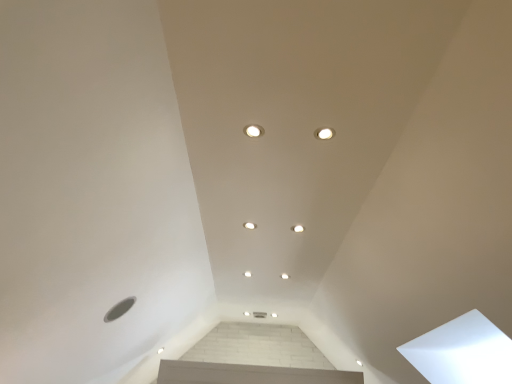
Question: Is the position of white glossy dot at center, which appears as the first dot when viewed from the left, less distant than that of white glossy light fixture at center, the fifth dot in the front-to-back sequence?

Choices:
 (A) yes
 (B) no

Answer: (A)

Question: From the image's perspective, would you say white glossy dot at center, the sixth dot viewed from the right, is shown under white glossy light fixture at center, which is the second dot in bottom-to-top order?

Choices:
 (A) no
 (B) yes

Answer: (A)

Question: Is white glossy dot at center, marked as the third dot in a bottom-to-top arrangement, outside of white glossy light fixture at center, the fifth dot in the front-to-back sequence?

Choices:
 (A) yes
 (B) no

Answer: (A)

Question: Are white glossy dot at center, which ranks as the 4th dot in front-to-back order, and white glossy light fixture at center, which is the fifth dot from top to bottom, far apart?

Choices:
 (A) yes
 (B) no

Answer: (B)

Question: Is white glossy light fixture at center, which appears as the second dot when viewed from the back, surrounded by white glossy dot at center, the sixth dot viewed from the right?

Choices:
 (A) yes
 (B) no

Answer: (B)

Question: In the image, is white glossy light fixture at center, acting as the 4th dot starting from the bottom, on the left side or the right side of white glossy light fixture at center, which appears as the second dot when viewed from the back?

Choices:
 (A) right
 (B) left

Answer: (A)

Question: Considering their positions, is white glossy light fixture at center, placed as the 5th dot when sorted from back to front, located in front of or behind white glossy light fixture at center, which appears as the second dot when viewed from the back?

Choices:
 (A) front
 (B) behind

Answer: (A)

Question: Is white glossy light fixture at center, placed as the 5th dot when sorted from back to front, inside the boundaries of white glossy light fixture at center, which is the second dot in bottom-to-top order, or outside?

Choices:
 (A) outside
 (B) inside

Answer: (A)

Question: From the image's perspective, is white glossy light fixture at center, which appears as the second dot when viewed from the right, positioned above or below white glossy light fixture at center, the fifth dot in the front-to-back sequence?

Choices:
 (A) above
 (B) below

Answer: (A)

Question: In terms of size, does white glossy light fixture at center, which is the fifth dot from top to bottom, appear bigger or smaller than white glossy dot at center, which ranks as the 4th dot in front-to-back order?

Choices:
 (A) big
 (B) small

Answer: (B)

Question: Is white glossy light fixture at center, which is counted as the fourth dot, starting from the left, situated inside white glossy dot at center, which ranks as the 4th dot in front-to-back order, or outside?

Choices:
 (A) outside
 (B) inside

Answer: (A)

Question: From the image's perspective, is white glossy light fixture at center, which is counted as the fourth dot, starting from the left, above or below white glossy dot at center, marked as the third dot in a bottom-to-top arrangement?

Choices:
 (A) above
 (B) below

Answer: (B)

Question: Considering their positions, is white glossy light fixture at center, which is counted as the fourth dot, starting from the left, located in front of or behind white glossy dot at center, positioned as the 3th dot in back-to-front order?

Choices:
 (A) front
 (B) behind

Answer: (B)

Question: Is white glossy dot at center, marked as the third dot in a bottom-to-top arrangement, inside or outside of white glossy light fixture at upper center, which ranks as the 1th dot in right-to-left order?

Choices:
 (A) outside
 (B) inside

Answer: (A)

Question: From a real-world perspective, relative to white glossy light fixture at upper center, the 1th dot viewed from the front, is white glossy dot at center, which ranks as the 4th dot in front-to-back order, vertically above or below?

Choices:
 (A) above
 (B) below

Answer: (B)